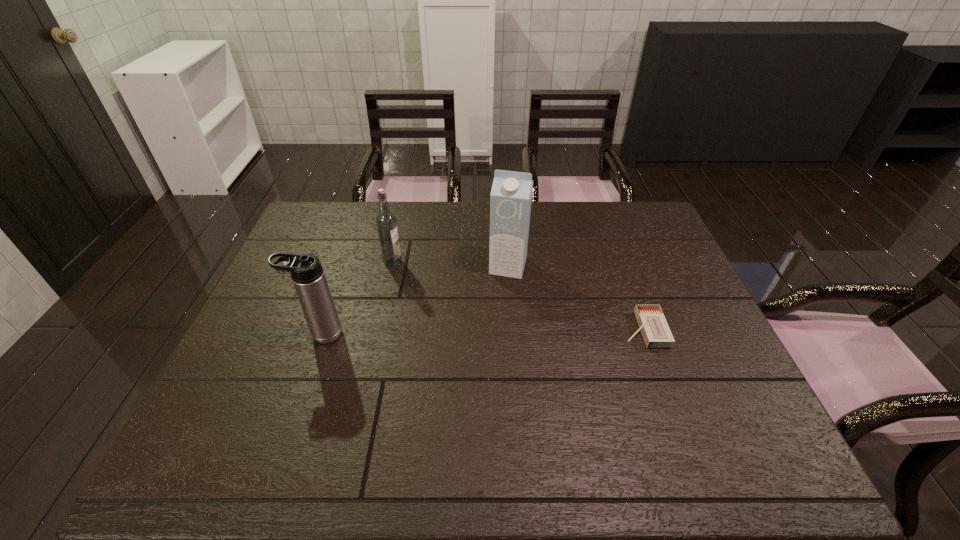
At what (x,y) coordinates should I click in order to perform the action: click on free spot on the desktop that is between the thermos bottle and the rightmost object and is positioned on the front label of the tallest object. Please return your answer as a coordinate pair (x, y). Looking at the image, I should click on (491, 332).

This screenshot has width=960, height=540. In order to click on free space on the desktop that is between the thermos bottle and the matchbox and is positioned on the label of the second object from left to right in this screenshot , I will do `click(482, 332)`.